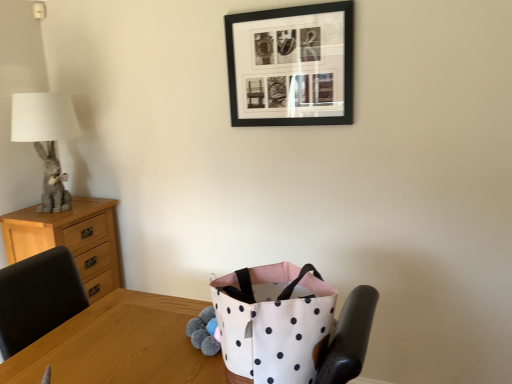
Where is `gray plush rabbit at left`? The image size is (512, 384). gray plush rabbit at left is located at coordinates (46, 139).

In order to face white fabric bag at center, should I rotate leftwards or rightwards?

Turn left approximately 2.596 degrees to face it.

What do you see at coordinates (291, 65) in the screenshot? The width and height of the screenshot is (512, 384). I see `black matte picture frame at upper center` at bounding box center [291, 65].

Image resolution: width=512 pixels, height=384 pixels. I want to click on black leather chair at left, so click(x=38, y=298).

How far apart are gray plush rabbit at left and white polka dot fabric shopping bag at center?

5.32 feet.

Does gray plush rabbit at left turn towards white polka dot fabric shopping bag at center?

No, gray plush rabbit at left does not turn towards white polka dot fabric shopping bag at center.

From the image's perspective, is gray plush rabbit at left beneath white polka dot fabric shopping bag at center?

Actually, gray plush rabbit at left appears above white polka dot fabric shopping bag at center in the image.

Is black matte picture frame at upper center positioned with its back to gray plush rabbit at left?

That's not correct — black matte picture frame at upper center is not looking away from gray plush rabbit at left.

Would you say black matte picture frame at upper center contains gray plush rabbit at left?

That's incorrect, gray plush rabbit at left is not inside black matte picture frame at upper center.

Considering the sizes of black matte picture frame at upper center and gray plush rabbit at left in the image, is black matte picture frame at upper center taller or shorter than gray plush rabbit at left?

In the image, black matte picture frame at upper center appears to be shorter than gray plush rabbit at left.

Can you confirm if white fabric bag at center is smaller than gray plush rabbit at left?

No, white fabric bag at center is not smaller than gray plush rabbit at left.

Is white fabric bag at center next to gray plush rabbit at left?

They are not placed beside each other.

Is white fabric bag at center facing away from gray plush rabbit at left?

white fabric bag at center does not have its back to gray plush rabbit at left.

Is white fabric bag at center located outside gray plush rabbit at left?

That's correct, white fabric bag at center is outside of gray plush rabbit at left.

Which is in front, white fabric bag at center or black matte picture frame at upper center?

white fabric bag at center is in front.

From a real-world perspective, is white fabric bag at center located beneath black matte picture frame at upper center?

Correct, in the physical world, white fabric bag at center is lower than black matte picture frame at upper center.

Where is `table below the black matte picture frame at upper center (from a real-world perspective)`? The image size is (512, 384). table below the black matte picture frame at upper center (from a real-world perspective) is located at coordinates (120, 345).

Is white fabric bag at center inside or outside of black matte picture frame at upper center?

white fabric bag at center is spatially situated outside black matte picture frame at upper center.

Is light wood chest of drawers at left thinner than black matte picture frame at upper center?

No, light wood chest of drawers at left is not thinner than black matte picture frame at upper center.

Is point (98, 250) less distant than point (338, 98)?

No, (98, 250) is further to viewer.

From the image's perspective, is light wood chest of drawers at left located above or below black matte picture frame at upper center?

light wood chest of drawers at left is below black matte picture frame at upper center.

Between light wood chest of drawers at left and black matte picture frame at upper center, which one has more height?

light wood chest of drawers at left is taller.

Which object is positioned more to the right, black leather chair at left or white polka dot fabric shopping bag at center?

From the viewer's perspective, white polka dot fabric shopping bag at center appears more on the right side.

Which object is more forward, black leather chair at left or white polka dot fabric shopping bag at center?

white polka dot fabric shopping bag at center is more forward.

Which object is thinner, black leather chair at left or white polka dot fabric shopping bag at center?

black leather chair at left.

Does point (71, 315) lie behind point (213, 290)?

Yes, it is behind point (213, 290).

Is point (242, 91) farther from camera compared to point (9, 263)?

No.

Between black matte picture frame at upper center and light wood chest of drawers at left, which one appears on the right side from the viewer's perspective?

black matte picture frame at upper center is more to the right.

Which object is thinner, black matte picture frame at upper center or light wood chest of drawers at left?

With smaller width is black matte picture frame at upper center.

Where is `table lamp located on the left of white polka dot fabric shopping bag at center`? The image size is (512, 384). table lamp located on the left of white polka dot fabric shopping bag at center is located at coordinates (46, 139).

The width and height of the screenshot is (512, 384). In the image, there is a gray plush rabbit at left. Find the location of `picture frame above it (from the image's perspective)`. picture frame above it (from the image's perspective) is located at coordinates (291, 65).

Looking at the image, which one is located closer to black leather chair at left, black matte picture frame at upper center or gray plush rabbit at left?

gray plush rabbit at left is positioned closer to the anchor black leather chair at left.

Looking at the image, which one is located further to black leather chair at left, light wood chest of drawers at left or black matte picture frame at upper center?

Among the two, black matte picture frame at upper center is located further to black leather chair at left.

Estimate the real-world distances between objects in this image. Which object is closer to gray plush rabbit at left, white polka dot fabric shopping bag at center or light wood chest of drawers at left?

Among the two, light wood chest of drawers at left is located nearer to gray plush rabbit at left.

When comparing their distances from black leather chair at left, does black matte picture frame at upper center or white polka dot fabric shopping bag at center seem further?

black matte picture frame at upper center is positioned further to the anchor black leather chair at left.

When comparing their distances from white fabric bag at center, does black matte picture frame at upper center or gray plush rabbit at left seem closer?

gray plush rabbit at left.

From the image, which object appears to be nearer to light wood chest of drawers at left, white fabric bag at center or black matte picture frame at upper center?

white fabric bag at center lies closer to light wood chest of drawers at left than the other object.

From the image, which object appears to be nearer to white polka dot fabric shopping bag at center, white fabric bag at center or black leather chair at left?

Among the two, white fabric bag at center is located nearer to white polka dot fabric shopping bag at center.

From the image, which object appears to be nearer to black leather chair at left, black matte picture frame at upper center or light wood chest of drawers at left?

light wood chest of drawers at left is closer to black leather chair at left.

The height and width of the screenshot is (384, 512). I want to click on chair positioned between white polka dot fabric shopping bag at center and gray plush rabbit at left from near to far, so click(38, 298).

Identify the location of shopping bag located between light wood chest of drawers at left and black matte picture frame at upper center in the left-right direction. The image size is (512, 384). (274, 322).

Find the location of `chair between white fabric bag at center and light wood chest of drawers at left along the z-axis`. chair between white fabric bag at center and light wood chest of drawers at left along the z-axis is located at coordinates (38, 298).

Locate an element on the screen. The height and width of the screenshot is (384, 512). table lamp between light wood chest of drawers at left and black matte picture frame at upper center from left to right is located at coordinates (46, 139).